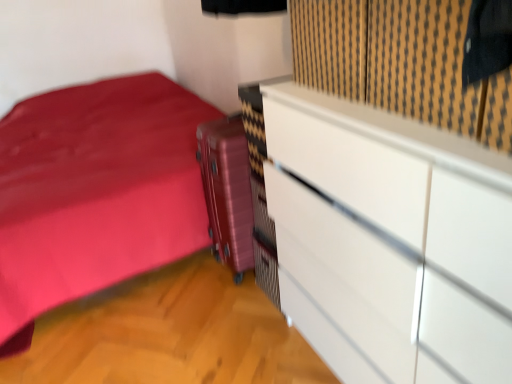
Question: Is metallic pink suitcase at center spatially inside black textured curtain at upper right, or outside of it?

Choices:
 (A) outside
 (B) inside

Answer: (A)

Question: Considering the positions of metallic pink suitcase at center and black textured curtain at upper right in the image, is metallic pink suitcase at center wider or thinner than black textured curtain at upper right?

Choices:
 (A) thin
 (B) wide

Answer: (A)

Question: Which of these objects is positioned farthest from the metallic pink suitcase at center?

Choices:
 (A) white glossy chest of drawers at upper right
 (B) black textured curtain at upper right

Answer: (B)

Question: Estimate the real-world distances between objects in this image. Which object is farther from the white glossy chest of drawers at upper right?

Choices:
 (A) black textured curtain at upper right
 (B) metallic pink suitcase at center

Answer: (B)